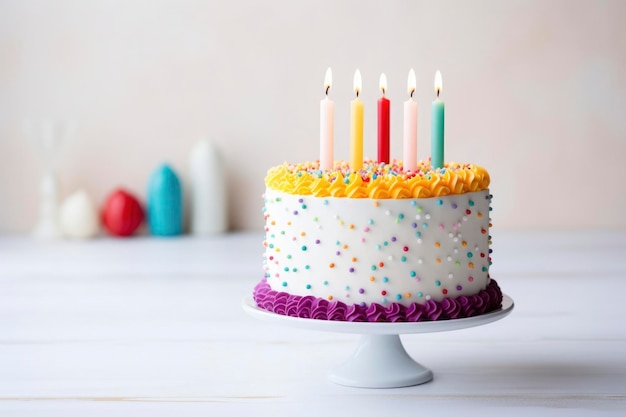
In order to click on candle wick in this screenshot , I will do `click(324, 92)`, `click(359, 91)`, `click(381, 91)`, `click(411, 90)`, `click(439, 92)`.